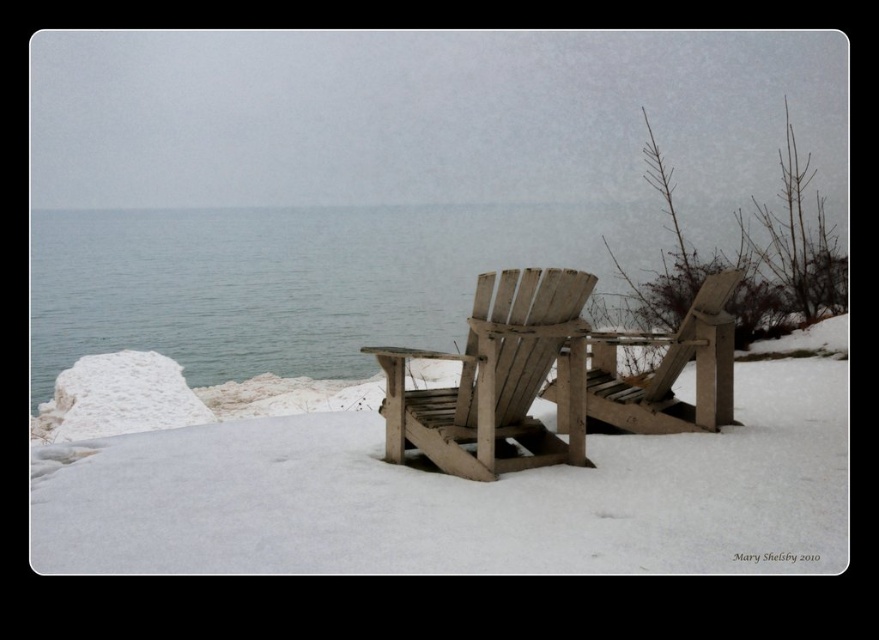
Question: Among these points, which one is farthest from the camera?

Choices:
 (A) (725, 301)
 (B) (323, 273)
 (C) (455, 387)

Answer: (B)

Question: Which object is farther from the camera taking this photo?

Choices:
 (A) clear water at center
 (B) white matte snow at center
 (C) weathered wood beach chair at center
 (D) wooden beach chair at center

Answer: (D)

Question: Does weathered wood beach chair at center have a greater width compared to wooden beach chair at center?

Choices:
 (A) no
 (B) yes

Answer: (B)

Question: Does white matte snow at center have a smaller size compared to weathered wood beach chair at center?

Choices:
 (A) yes
 (B) no

Answer: (A)

Question: Which of the following is the closest to the observer?

Choices:
 (A) white matte snow at center
 (B) weathered wood beach chair at center
 (C) wooden beach chair at center

Answer: (A)

Question: Where is clear water at center located in relation to wooden beach chair at center in the image?

Choices:
 (A) above
 (B) below

Answer: (A)